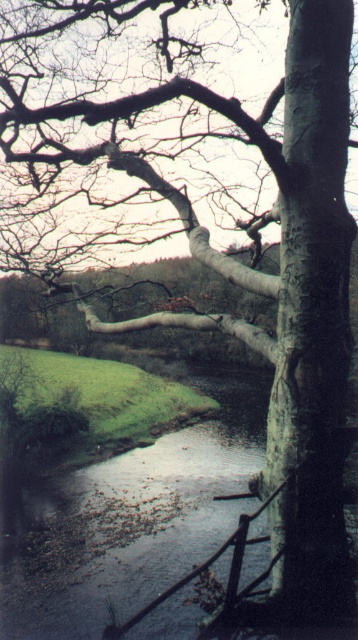
Question: Which point is closer to the camera taking this photo?

Choices:
 (A) (340, 132)
 (B) (81, 618)

Answer: (A)

Question: Can you confirm if white smooth tree trunk at right is bigger than smooth gray river at center?

Choices:
 (A) no
 (B) yes

Answer: (A)

Question: Does white smooth tree trunk at right lie behind smooth gray river at center?

Choices:
 (A) yes
 (B) no

Answer: (A)

Question: Can you confirm if white smooth tree trunk at right is bigger than smooth gray river at center?

Choices:
 (A) no
 (B) yes

Answer: (A)